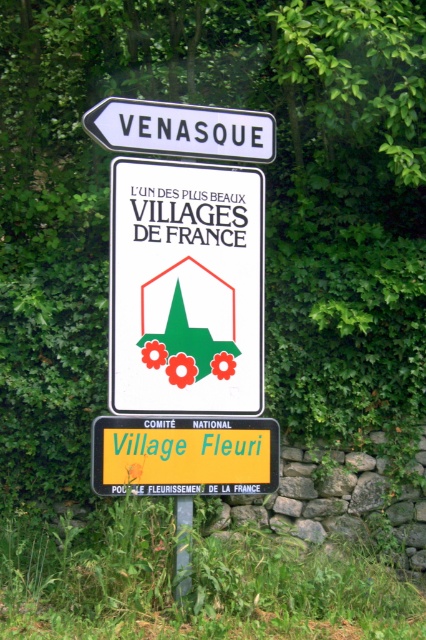
This screenshot has height=640, width=426. What do you see at coordinates (186, 288) in the screenshot? I see `white paper sign at upper center` at bounding box center [186, 288].

Who is lower down, white paper sign at upper center or white plastic sign at upper center?

white paper sign at upper center

The width and height of the screenshot is (426, 640). Identify the location of white paper sign at upper center. point(186,288).

Locate an element on the screen. white paper sign at upper center is located at coordinates (186, 288).

Does yellow plastic sign at center have a larger size compared to white plastic sign at upper center?

Indeed, yellow plastic sign at center has a larger size compared to white plastic sign at upper center.

Between yellow plastic sign at center and white plastic sign at upper center, which one has more height?

yellow plastic sign at center

Who is more forward, (111, 426) or (267, 160)?

Point (111, 426) is in front.

Image resolution: width=426 pixels, height=640 pixels. Find the location of `yellow plastic sign at center`. yellow plastic sign at center is located at coordinates (184, 456).

Find the location of a particular element. white paper sign at upper center is located at coordinates (186, 288).

Is white paper sign at upper center above yellow plastic sign at center?

Yes, white paper sign at upper center is above yellow plastic sign at center.

You are a GUI agent. You are given a task and a screenshot of the screen. Output one action in this format:
    pyautogui.click(x=<x>, y=<y>)
    Task: Click on the white paper sign at upper center
    The image size is (426, 640).
    Given the screenshot: What is the action you would take?
    pyautogui.click(x=186, y=288)